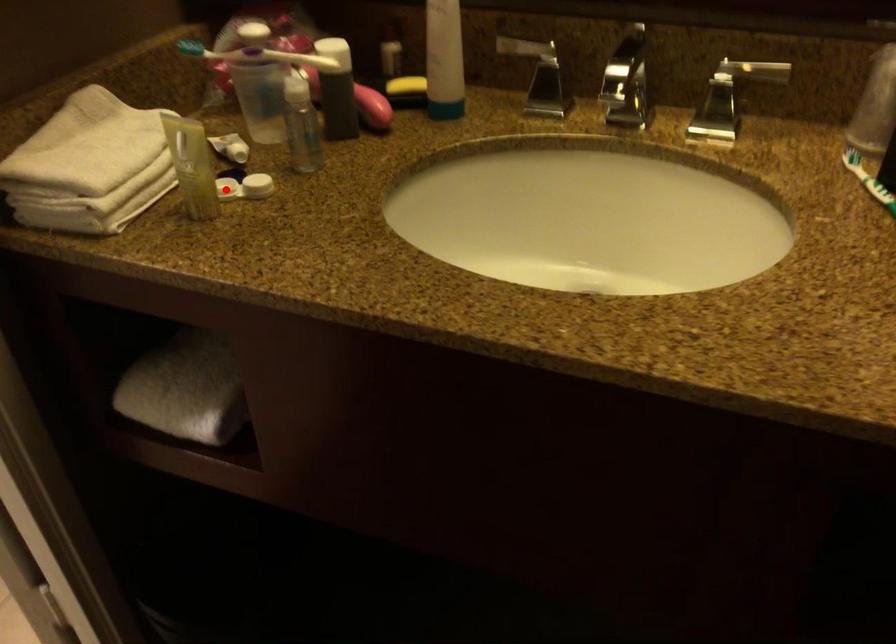
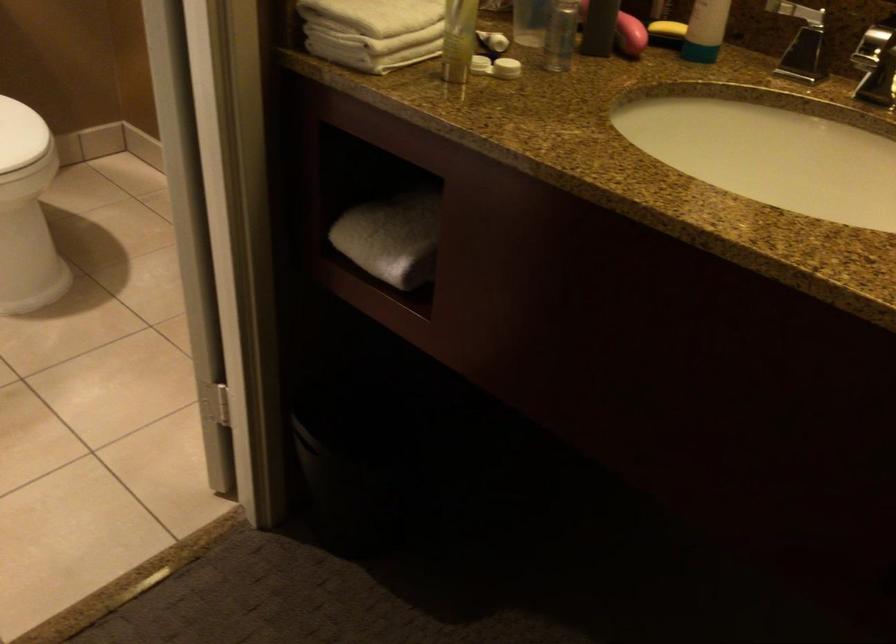
Question: I am providing you with two images of the same scene from different viewpoints. Given a red point in image1, look at the same physical point in image2. Is it:

Choices:
 (A) Closer to the viewpoint
 (B) Farther from the viewpoint

Answer: (B)